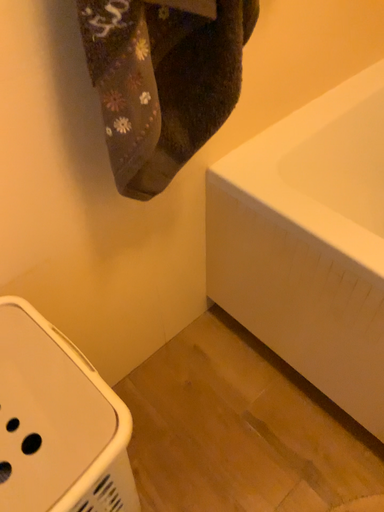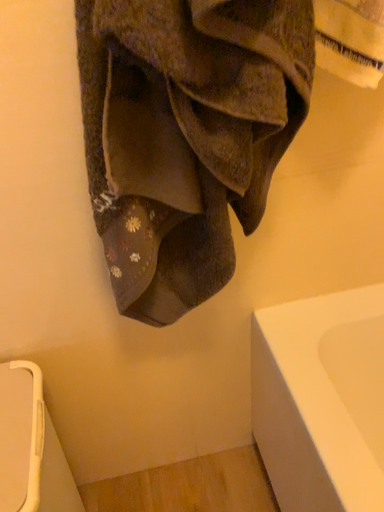
Question: How did the camera likely rotate when shooting the video?

Choices:
 (A) rotated upward
 (B) rotated downward

Answer: (A)